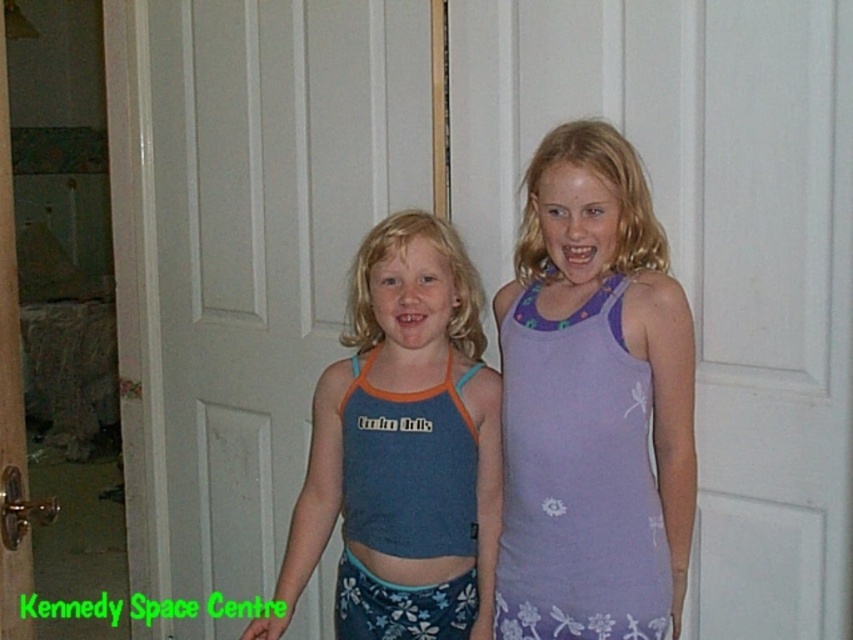
You are a painter who needs to hang a 1.5 meter tall painting on the wall behind the white matte door at center and the blue fabric tank top at center. Which object should the painting be placed near to ensure it fits vertically without being too cramped?

The white matte door at center has a greater height compared to the blue fabric tank top at center, so the painting should be placed near the white matte door at center as it can accommodate the painting vertically without being too cramped.

Based on the photo, you are a delivery person trying to hand a package to the girls in the image. You see the blue fabric tank top at center and the white matte door at center. Which object should you go around to reach the girls?

The blue fabric tank top at center is behind the white matte door at center, so you should go around the white matte door at center to reach the girls.

You are taking a photo of two girls standing in front of a white door. The girls are at points labeled as point (653, 563) and point (457, 474). Which point is closer to the camera?

Point (653, 563) is closer to the camera than point (457, 474).